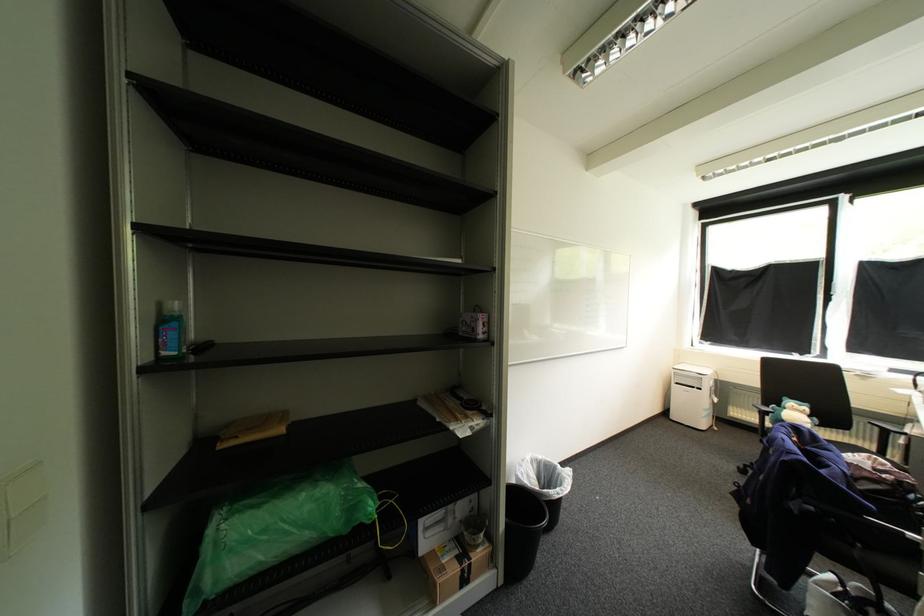
Image resolution: width=924 pixels, height=616 pixels. I want to click on brown paper package, so 454,567.